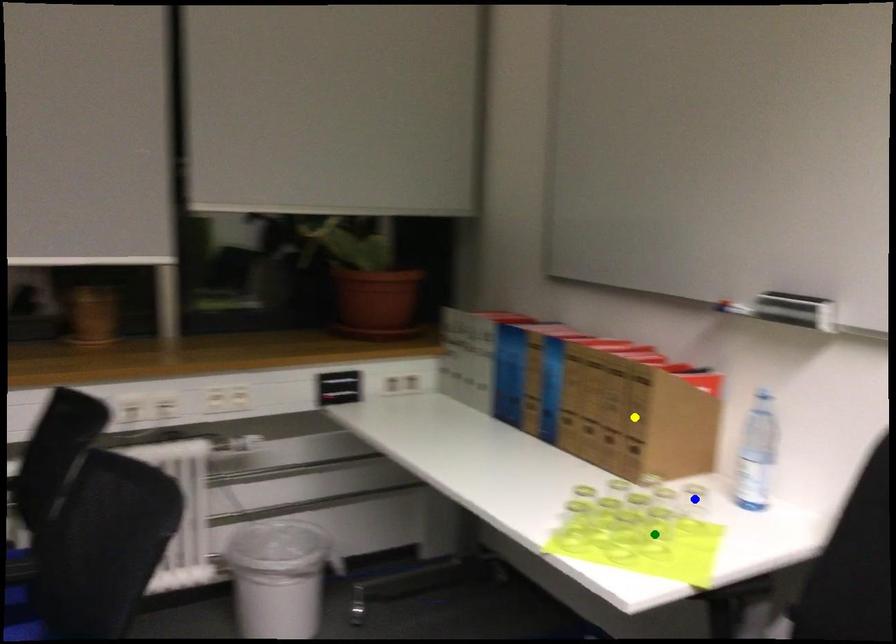
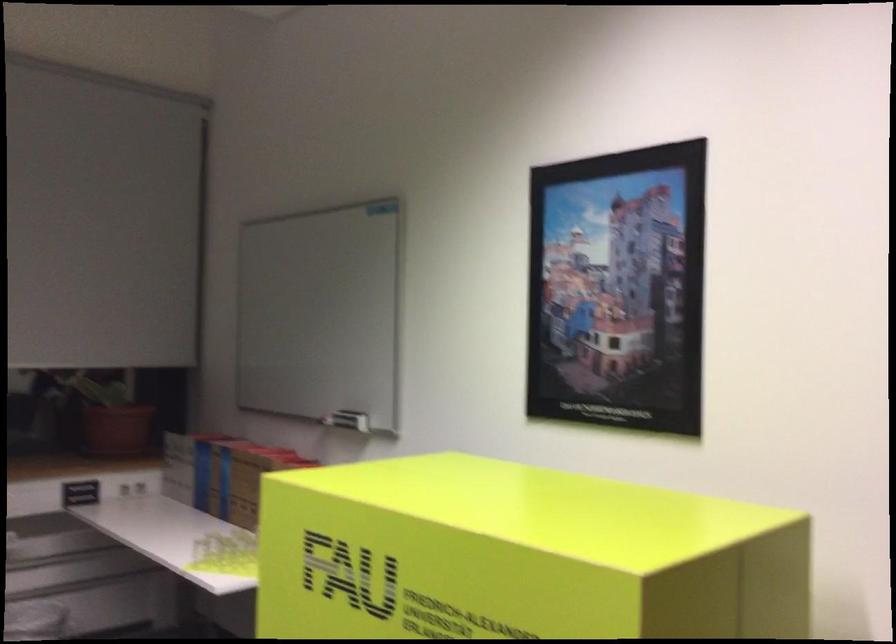
I am providing you with two images of the same scene from different viewpoints. Three points are marked in image1. Which point corresponds to a part or object that is occluded in image2?In image1, three points are marked. Which of them correspond to a part or object that is occluded in image2?Among the three points shown in image1, which one corresponds to a part or object that is no longer visible due to occlusion in image2?

Invisible in image2: yellow point, blue point, green point.